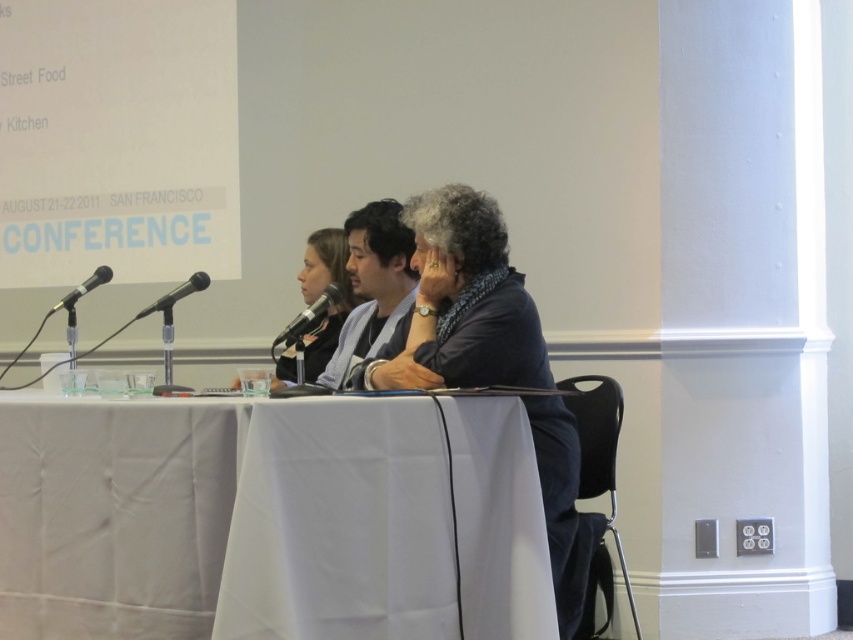
Question: Can you confirm if matte black jacket at center is positioned to the left of black metallic microphone at left?

Choices:
 (A) no
 (B) yes

Answer: (A)

Question: Which point appears farthest from the camera in this image?

Choices:
 (A) (346, 312)
 (B) (172, 296)
 (C) (93, 280)
 (D) (323, 291)

Answer: (A)

Question: Observing the image, what is the correct spatial positioning of matte black jacket at center in reference to black matte microphone at center?

Choices:
 (A) left
 (B) right

Answer: (A)

Question: Observing the image, what is the correct spatial positioning of black matte microphone at center in reference to black metallic microphone at left?

Choices:
 (A) below
 (B) above

Answer: (A)

Question: Which of the following is the closest to the observer?

Choices:
 (A) (33, 520)
 (B) (341, 269)

Answer: (A)

Question: Which point is farther to the camera?

Choices:
 (A) (310, 314)
 (B) (199, 282)
 (C) (310, 348)

Answer: (C)